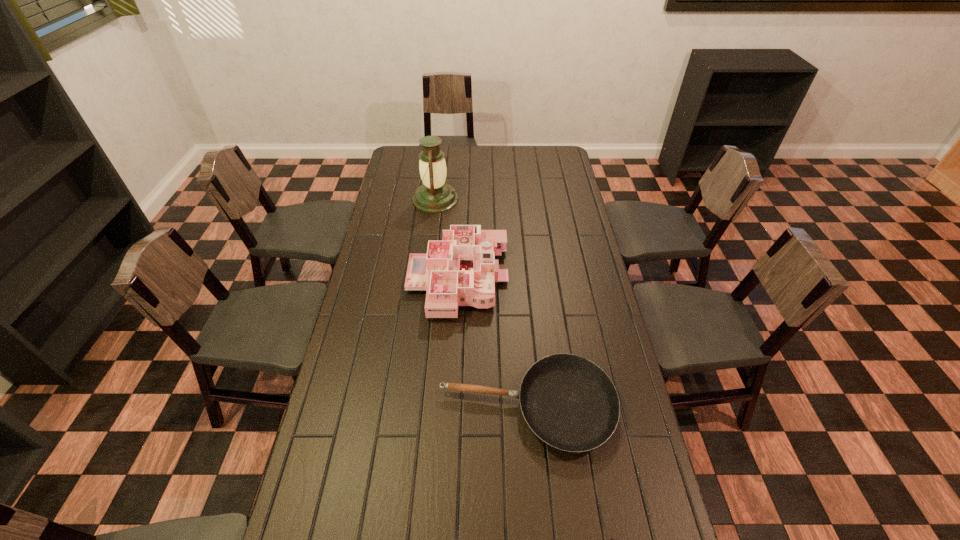
Locate an element on the screen. free location that satisfies the following two spatial constraints: 1. with the light compartment facing forward on the third tallest object; 2. on the right side of the tallest object is located at coordinates (410, 407).

At what (x,y) coordinates should I click in order to perform the action: click on blank area in the image that satisfies the following two spatial constraints: 1. with the light compartment facing forward on the frying pan; 2. on the right side of the tallest object. Please return your answer as a coordinate pair (x, y). Looking at the image, I should click on (410, 407).

At what (x,y) coordinates should I click in order to perform the action: click on free spot that satisfies the following two spatial constraints: 1. with the light compartment facing forward on the frying pan; 2. on the right side of the farthest object. Please return your answer as a coordinate pair (x, y). The image size is (960, 540). Looking at the image, I should click on (410, 407).

Image resolution: width=960 pixels, height=540 pixels. Identify the location of free location that satisfies the following two spatial constraints: 1. with the light compartment facing forward on the tallest object; 2. on the left side of the second shortest object. (410, 407).

Where is `vacant space that satisfies the following two spatial constraints: 1. with the light compartment facing forward on the tallest object; 2. on the back side of the frying pan`? vacant space that satisfies the following two spatial constraints: 1. with the light compartment facing forward on the tallest object; 2. on the back side of the frying pan is located at coordinates (410, 407).